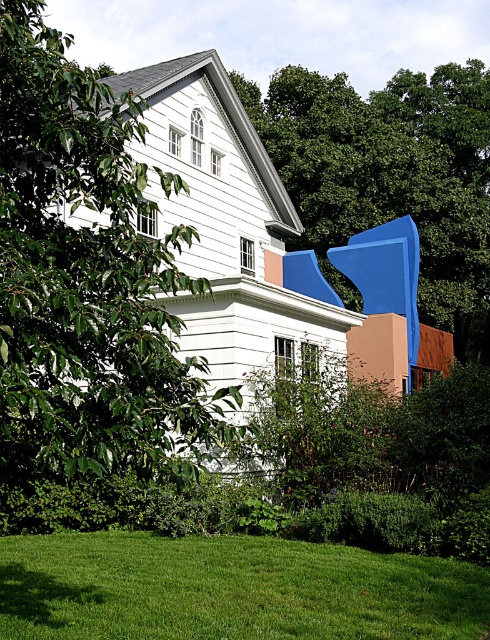
Who is more distant from viewer, [173,476] or [358,141]?

The point [358,141] is more distant.

Which of these two, green leafy tree at left or blue matte sculpture at upper right, stands shorter?

A: green leafy tree at left is shorter.

Is point (54, 125) closer to camera compared to point (461, 330)?

Yes, it is.

Locate an element on the screen. green leafy tree at left is located at coordinates (87, 282).

The height and width of the screenshot is (640, 490). What do you see at coordinates (230, 589) in the screenshot? I see `green grass at lower center` at bounding box center [230, 589].

Which of these two, green grass at lower center or blue matte sculpture at upper right, stands taller?

blue matte sculpture at upper right

The image size is (490, 640). Identify the location of green grass at lower center. (230, 589).

Find the location of a particular element. green grass at lower center is located at coordinates (230, 589).

Which is more to the left, green leafy tree at left or green grass at lower center?

green leafy tree at left

Between green leafy tree at left and green grass at lower center, which one appears on the right side from the viewer's perspective?

green grass at lower center

Is point (127, 248) positioned before point (92, 566)?

Yes, point (127, 248) is closer to viewer.

Locate an element on the screen. green leafy tree at left is located at coordinates (x=87, y=282).